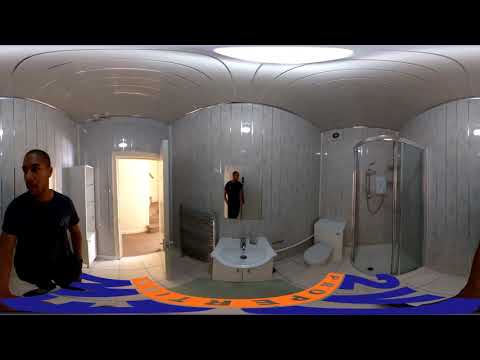
Identify the location of door. This screenshot has height=360, width=480. (162, 182).